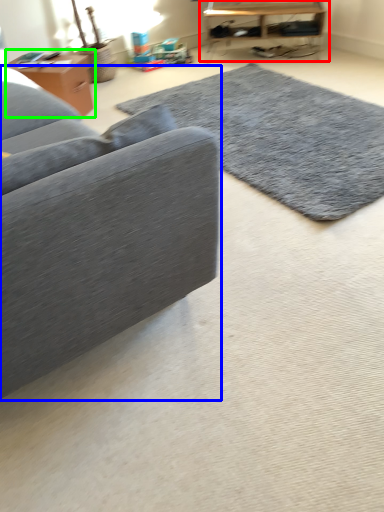
Question: Which object is positioned closest to table (highlighted by a red box)? Select from studio couch (highlighted by a blue box) and table (highlighted by a green box).

Choices:
 (A) studio couch
 (B) table

Answer: (B)